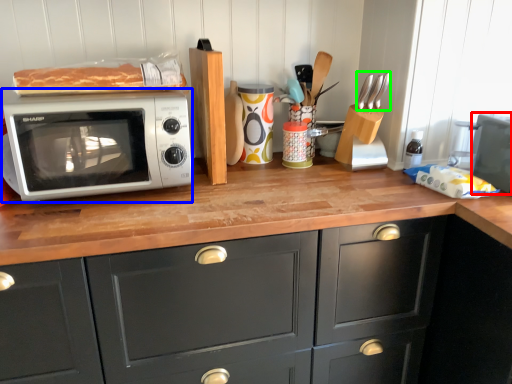
Question: Based on their relative distances, which object is farther from appliance (highlighted by a red box)? Choose from microwave oven (highlighted by a blue box) and silverware (highlighted by a green box).

Choices:
 (A) microwave oven
 (B) silverware

Answer: (A)